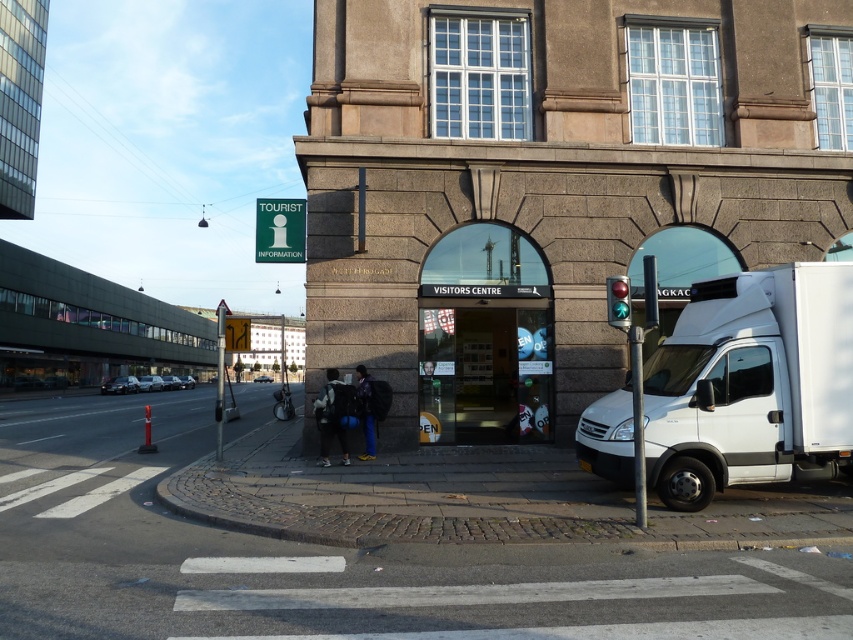
Question: Is white matte truck at right wider than metallic reflective traffic light at right?

Choices:
 (A) no
 (B) yes

Answer: (B)

Question: Observing the image, what is the correct spatial positioning of white matte truck at right in reference to metallic reflective traffic light at right?

Choices:
 (A) below
 (B) above

Answer: (A)

Question: Which point is farther to the camera?

Choices:
 (A) (776, 397)
 (B) (625, 320)

Answer: (A)

Question: From the image, what is the correct spatial relationship of white matte truck at right in relation to metallic reflective traffic light at right?

Choices:
 (A) left
 (B) right

Answer: (B)

Question: Among these points, which one is nearest to the camera?

Choices:
 (A) pos(723,413)
 (B) pos(611,323)

Answer: (B)